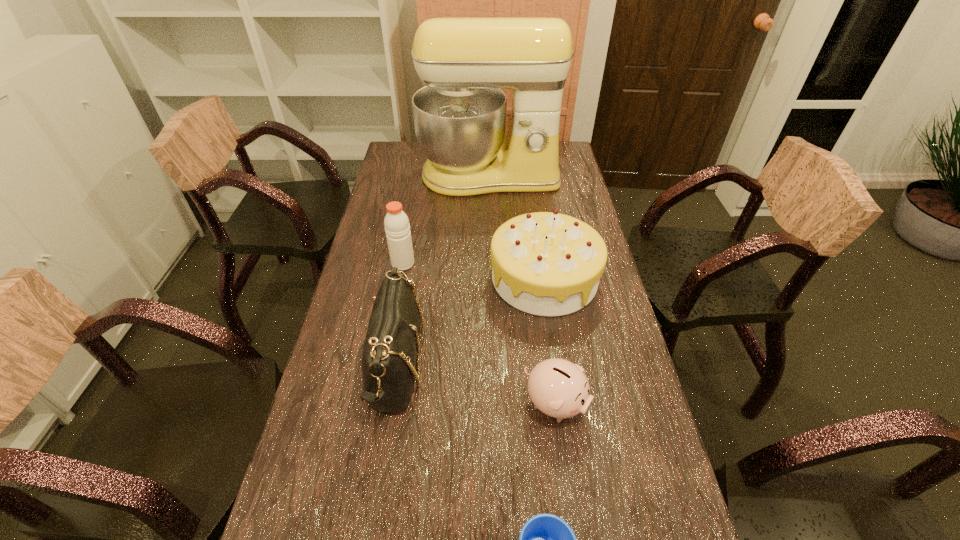
Identify the location of the tallest object. This screenshot has height=540, width=960. (460, 115).

The height and width of the screenshot is (540, 960). Find the location of `the farthest object`. the farthest object is located at coordinates (460, 115).

Image resolution: width=960 pixels, height=540 pixels. I want to click on shaker, so click(x=397, y=228).

Where is `handbag`? handbag is located at coordinates (390, 350).

This screenshot has width=960, height=540. I want to click on birthday cake, so click(549, 264).

Locate an element on the screen. The width and height of the screenshot is (960, 540). the second shortest object is located at coordinates (557, 387).

Where is `vacant space located 0.070m on the side of the mixer with the control knob`? Image resolution: width=960 pixels, height=540 pixels. vacant space located 0.070m on the side of the mixer with the control knob is located at coordinates [x=491, y=211].

Identify the location of free region located on the back of the shaker. (408, 237).

The width and height of the screenshot is (960, 540). In order to click on vacant region located 0.140m at the front of the handbag with chain and zipper in this screenshot , I will do `click(479, 364)`.

Where is `free location located 0.390m on the back of the birthday cake`? The width and height of the screenshot is (960, 540). free location located 0.390m on the back of the birthday cake is located at coordinates (530, 181).